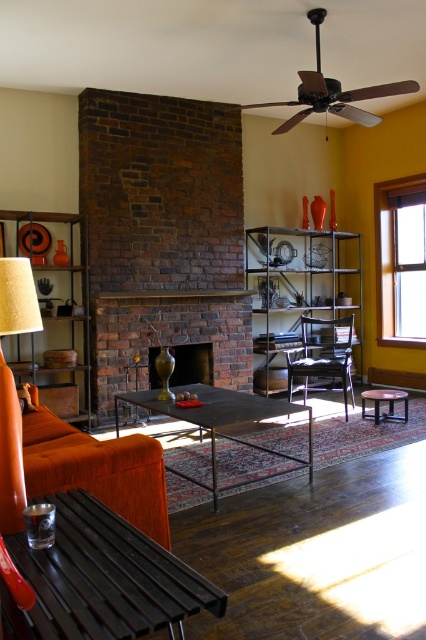
Does matte black bench at lower left have a greater width compared to metal/textured shelving unit at center?

In fact, matte black bench at lower left might be narrower than metal/textured shelving unit at center.

Can you confirm if matte black bench at lower left is positioned above metal/textured shelving unit at center?

Actually, matte black bench at lower left is below metal/textured shelving unit at center.

Is point (209, 592) positioned after point (322, 257)?

No, (209, 592) is closer to viewer.

The height and width of the screenshot is (640, 426). In order to click on matte black bench at lower left in this screenshot , I will do `click(101, 579)`.

Is velvet orange couch at lower left to the left of clear glass window at upper right from the viewer's perspective?

Yes, velvet orange couch at lower left is to the left of clear glass window at upper right.

Who is more distant from viewer, (144,440) or (394,298)?

The point (394,298) is more distant.

Does point (109, 476) come behind point (385, 234)?

No, (109, 476) is in front of (385, 234).

In order to click on velvet orange couch at lower left in this screenshot , I will do `click(97, 468)`.

Can you confirm if orange fabric lampshade at left is wider than matte orange armchair at center?

In fact, orange fabric lampshade at left might be narrower than matte orange armchair at center.

Is point (11, 396) farther from camera compared to point (345, 336)?

That is False.

Locate an element on the screen. This screenshot has width=426, height=640. orange fabric lampshade at left is located at coordinates (11, 454).